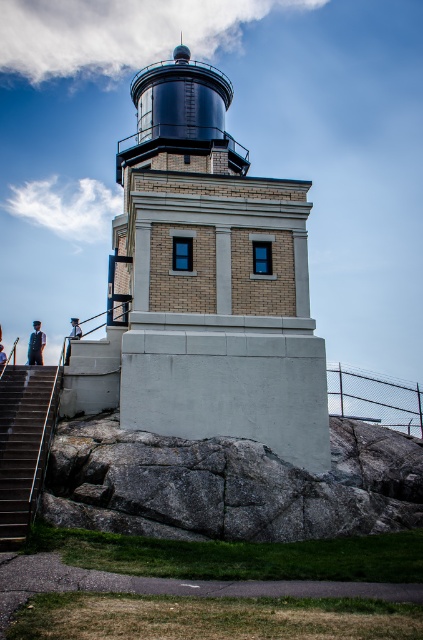
Which is more to the left, brick textured tower at center or gray rock at lower center?

brick textured tower at center is more to the left.

Which is behind, point (299, 368) or point (52, 493)?

The point (299, 368) is behind.

The height and width of the screenshot is (640, 423). I want to click on brick textured tower at center, so click(205, 284).

Which is in front, point (134, 232) or point (38, 326)?

Positioned in front is point (134, 232).

Who is more distant from viewer, [73,371] or [30,339]?

The point [30,339] is more distant.

Between point (170, 113) and point (38, 358), which one is positioned behind?

The point (170, 113) is behind.

In order to click on brick textured tower at center in this screenshot , I will do `click(205, 284)`.

Who is more distant from viewer, (214, 172) or (16, 458)?

Point (214, 172)

Which is in front, point (200, 90) or point (13, 492)?

Point (13, 492)

Is point (175, 371) farther from viewer compared to point (54, 412)?

No, (175, 371) is closer to viewer.

You are a GUI agent. You are given a task and a screenshot of the screen. Output one action in this format:
    pyautogui.click(x=<x>, y=<y>)
    Task: Click on the brick textured tower at center
    
    Given the screenshot: What is the action you would take?
    pyautogui.click(x=205, y=284)